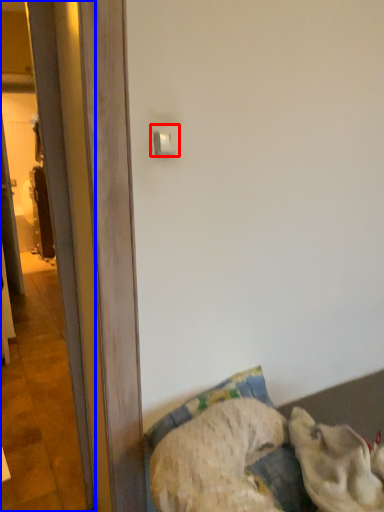
Question: Which point is closer to the camera, light switch (highlighted by a red box) or screen door (highlighted by a blue box)?

Choices:
 (A) light switch
 (B) screen door

Answer: (B)